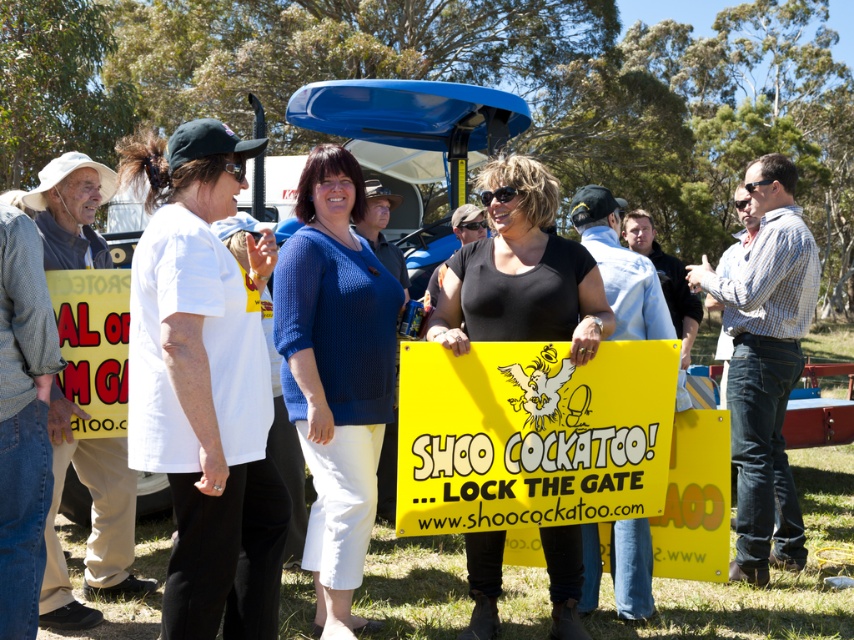
You are a photographer at the event and want to capture a photo of both the blue knitted sweater at center and the yellow paper sign at center in the same frame. Based on their positions, which object should you focus on first to ensure both are in the frame?

The blue knitted sweater at center is located below the yellow paper sign at center. To include both in the frame, focus on the yellow paper sign at center first as it is higher up, ensuring the lower positioned blue knitted sweater at center remains within the shot.